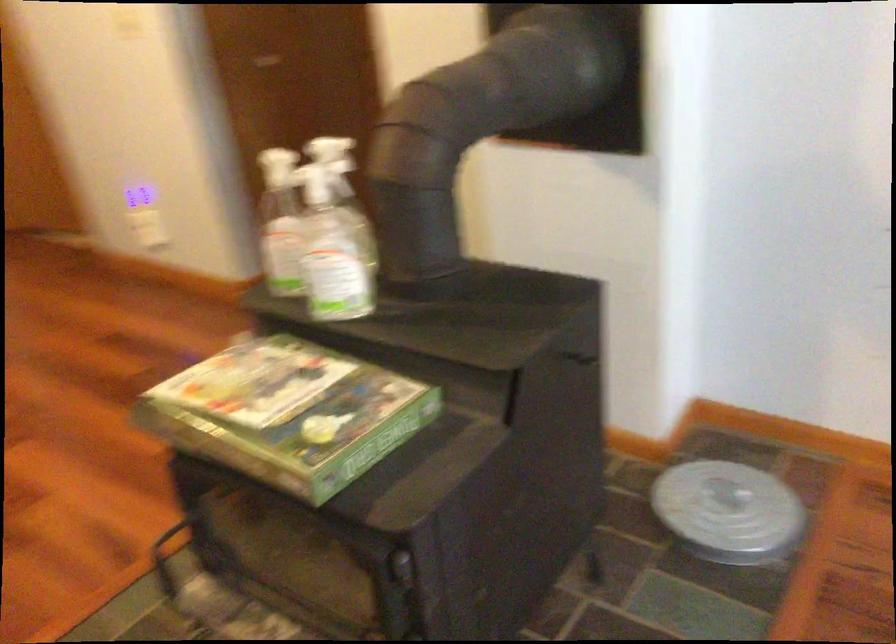
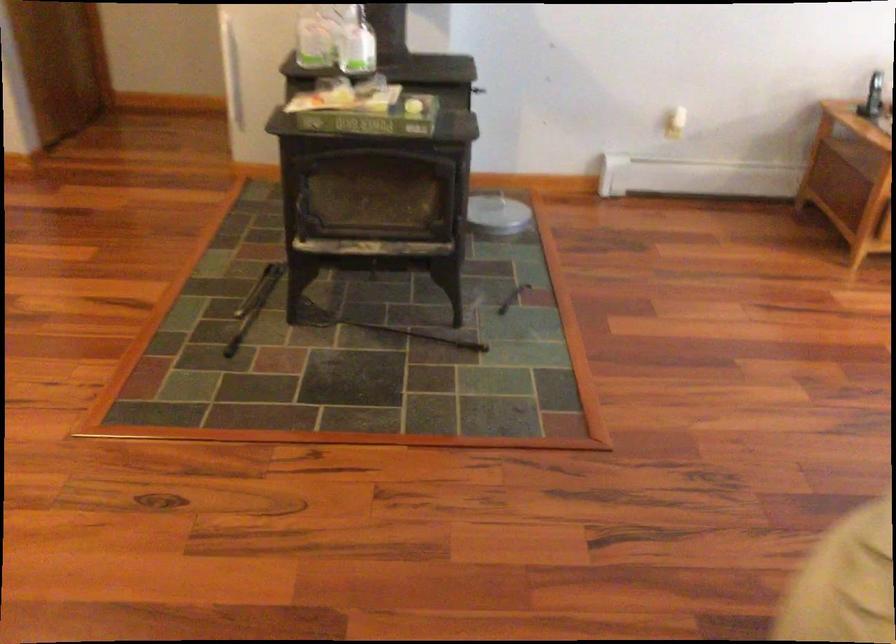
In the second image, find the point that corresponds to point (234, 436) in the first image.

(366, 116)